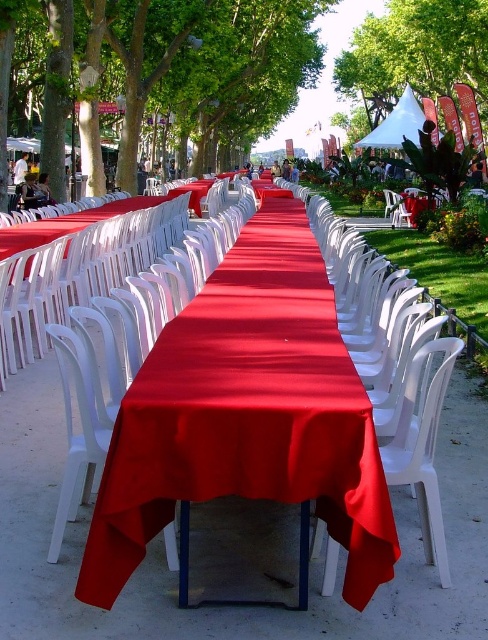
Question: Which object is positioned closest to the red matte tablecloth at center?

Choices:
 (A) white canvas canopy at upper center
 (B) green leafy tree at center
 (C) green leafy tree at upper center

Answer: (A)

Question: Where is green leafy tree at upper center located in relation to white plastic chair at center in the image?

Choices:
 (A) above
 (B) below

Answer: (A)

Question: Is green leafy tree at center closer to the viewer compared to white canvas canopy at upper center?

Choices:
 (A) yes
 (B) no

Answer: (A)

Question: Which point is farther to the camera?

Choices:
 (A) (287, 340)
 (B) (369, 132)

Answer: (B)

Question: Is green leafy tree at center to the left of white canvas canopy at upper center from the viewer's perspective?

Choices:
 (A) yes
 (B) no

Answer: (A)

Question: Which point is farther to the camera?

Choices:
 (A) white plastic chair at center
 (B) red matte tablecloth at center
 (C) white canvas canopy at upper center

Answer: (C)